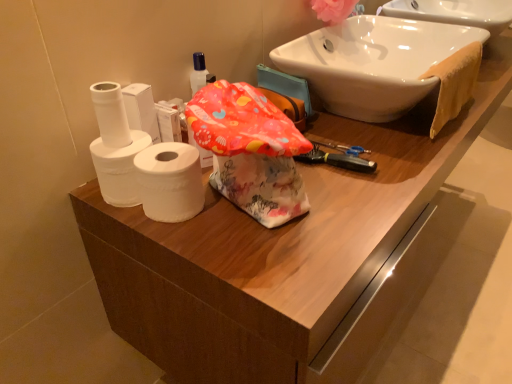
Question: From a real-world perspective, is pink fabric flower at upper right located beneath white glossy sink at upper right?

Choices:
 (A) yes
 (B) no

Answer: (B)

Question: Is pink fabric flower at upper right taller than white glossy sink at upper right?

Choices:
 (A) yes
 (B) no

Answer: (B)

Question: Does pink fabric flower at upper right turn towards white glossy sink at upper right?

Choices:
 (A) yes
 (B) no

Answer: (B)

Question: Is pink fabric flower at upper right at the left side of white glossy sink at upper right?

Choices:
 (A) no
 (B) yes

Answer: (B)

Question: From a real-world perspective, is pink fabric flower at upper right on white glossy sink at upper right?

Choices:
 (A) yes
 (B) no

Answer: (A)

Question: Is white matte toilet paper at left, arranged as the 3th toilet paper when viewed from the left, situated inside white matte toilet paper at left, placed as the 2th toilet paper when sorted from left to right, or outside?

Choices:
 (A) inside
 (B) outside

Answer: (B)

Question: From a real-world perspective, is white matte toilet paper at left, positioned as the first toilet paper in right-to-left order, above or below white matte toilet paper at left, placed as the 2th toilet paper when sorted from left to right?

Choices:
 (A) above
 (B) below

Answer: (A)

Question: From their relative heights in the image, would you say white matte toilet paper at left, arranged as the 3th toilet paper when viewed from the left, is taller or shorter than white matte toilet paper at left, the 2th toilet paper positioned from the right?

Choices:
 (A) short
 (B) tall

Answer: (B)

Question: Considering the relative positions of white matte toilet paper at left, positioned as the first toilet paper in right-to-left order, and white matte toilet paper at left, placed as the 2th toilet paper when sorted from left to right, in the image provided, is white matte toilet paper at left, positioned as the first toilet paper in right-to-left order, to the left or to the right of white matte toilet paper at left, placed as the 2th toilet paper when sorted from left to right,?

Choices:
 (A) right
 (B) left

Answer: (A)

Question: Is point (197, 160) closer or farther from the camera than point (329, 21)?

Choices:
 (A) farther
 (B) closer

Answer: (B)

Question: In terms of width, does white matte toilet paper at left, arranged as the 3th toilet paper when viewed from the left, look wider or thinner when compared to pink fabric flower at upper right?

Choices:
 (A) wide
 (B) thin

Answer: (B)

Question: From a real-world perspective, is white matte toilet paper at left, arranged as the 3th toilet paper when viewed from the left, physically located above or below pink fabric flower at upper right?

Choices:
 (A) below
 (B) above

Answer: (A)

Question: Would you say white matte toilet paper at left, arranged as the 3th toilet paper when viewed from the left, is inside or outside pink fabric flower at upper right?

Choices:
 (A) inside
 (B) outside

Answer: (B)

Question: From a real-world perspective, relative to white matte toilet paper at left, arranged as the 3th toilet paper when viewed from the left, is orange cloth towel at upper right vertically above or below?

Choices:
 (A) above
 (B) below

Answer: (A)

Question: Based on their positions, is orange cloth towel at upper right located to the left or right of white matte toilet paper at left, arranged as the 3th toilet paper when viewed from the left?

Choices:
 (A) right
 (B) left

Answer: (A)